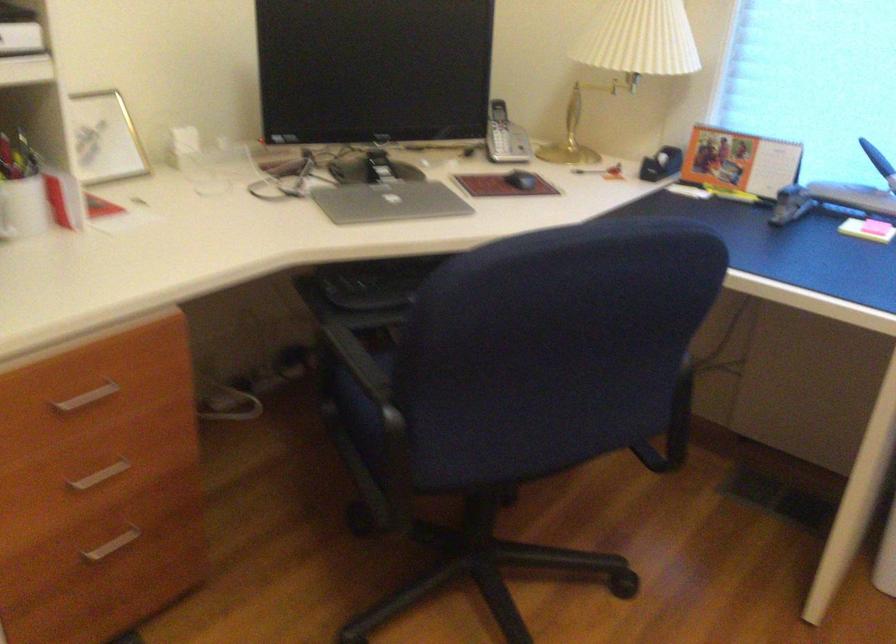
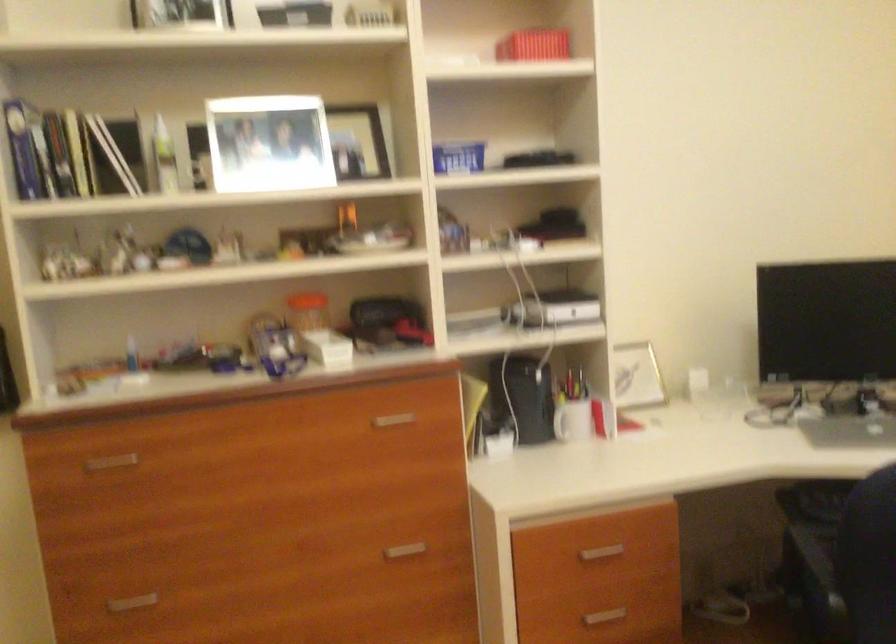
First-person continuous shooting, in which direction is the camera rotating?

The rotation direction of the camera is left-up.